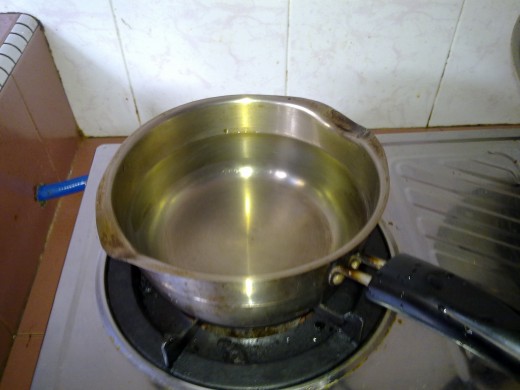
Locate an element on the screen. This screenshot has height=390, width=520. water in pan is located at coordinates (270, 212).